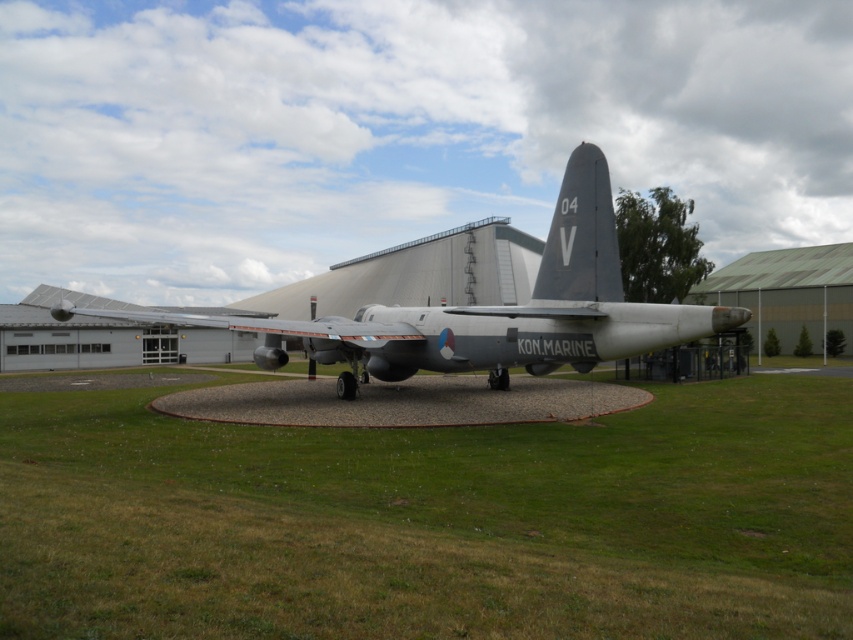
Which is in front, point (231, 476) or point (612, 276)?

Point (231, 476)

Does green grass at center appear under silver metallic airplane at center?

Indeed, green grass at center is positioned under silver metallic airplane at center.

Between point (544, 493) and point (596, 323), which one is positioned behind?

Positioned behind is point (596, 323).

Find the location of a particular element. This screenshot has height=640, width=853. green grass at center is located at coordinates (432, 522).